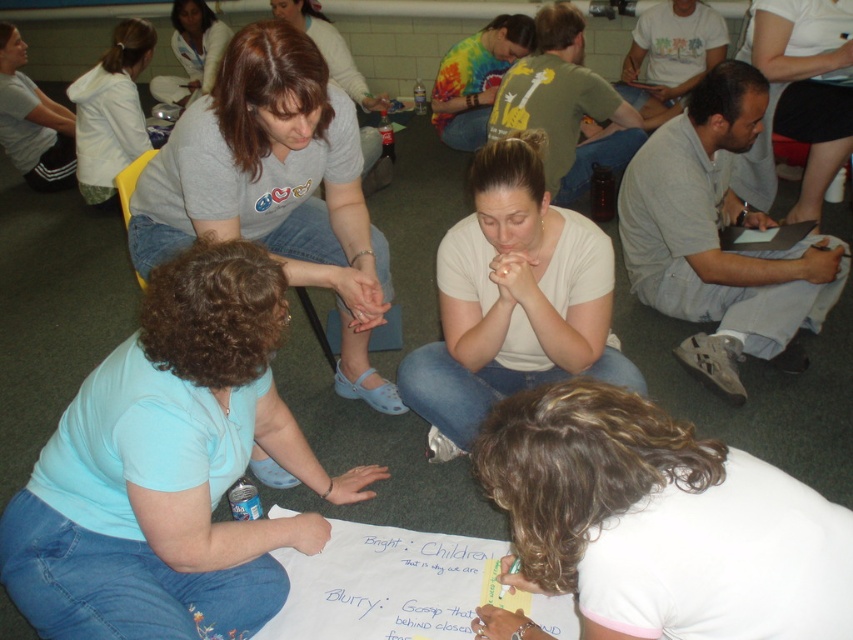
Question: Can you confirm if white matte shirt at center is positioned to the right of gray matte laptop at right?

Choices:
 (A) yes
 (B) no

Answer: (B)

Question: Is light blue cotton shirt at lower left to the left of white matte shirt at lower center from the viewer's perspective?

Choices:
 (A) no
 (B) yes

Answer: (B)

Question: Based on their relative distances, which object is farther from the white matte shirt at center?

Choices:
 (A) white matte shirt at upper left
 (B) gray matte laptop at right
 (C) white cotton shirt at upper center
 (D) white matte shirt at upper right

Answer: (C)

Question: Among these points, which one is farthest from the camera?

Choices:
 (A) (804, 124)
 (B) (192, 96)
 (C) (276, 20)

Answer: (B)

Question: Which object is positioned farthest from the matte gray shirt at center?

Choices:
 (A) gray matte laptop at right
 (B) white matte shirt at upper left
 (C) light blue cotton shirt at lower left

Answer: (B)

Question: Can you confirm if matte gray shirt at center is smaller than white cotton shirt at upper center?

Choices:
 (A) no
 (B) yes

Answer: (A)